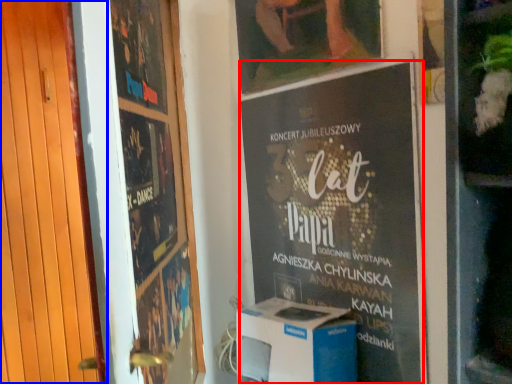
Question: Which of the following is the closest to the observer, poster (highlighted by a red box) or door (highlighted by a blue box)?

Choices:
 (A) poster
 (B) door

Answer: (B)